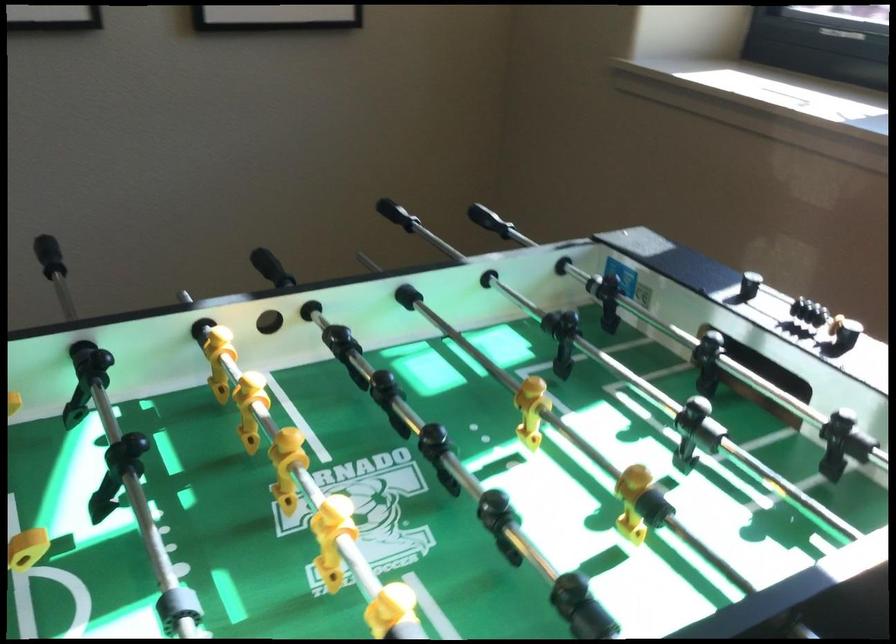
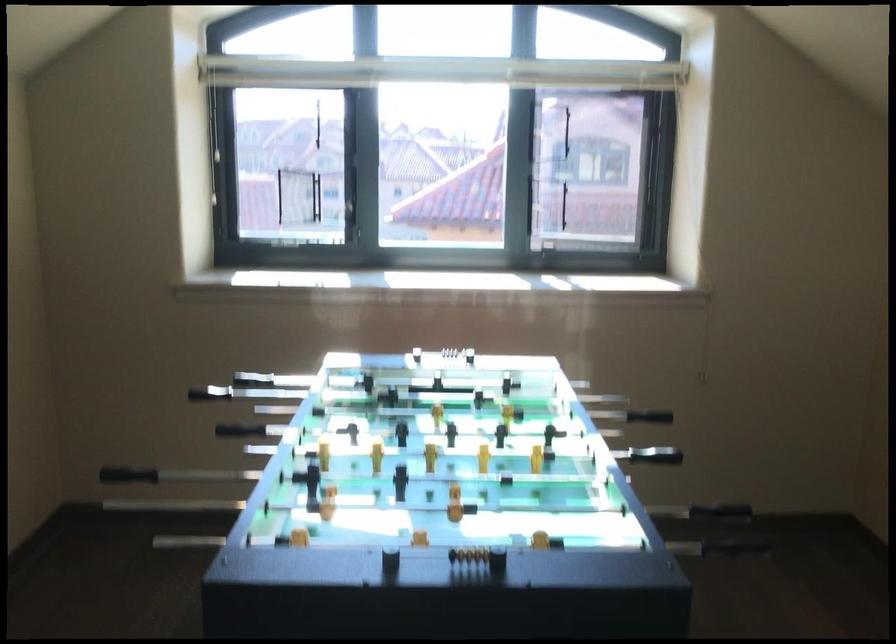
Find the pixel in the second image that matches (798,307) in the first image.

(434, 353)